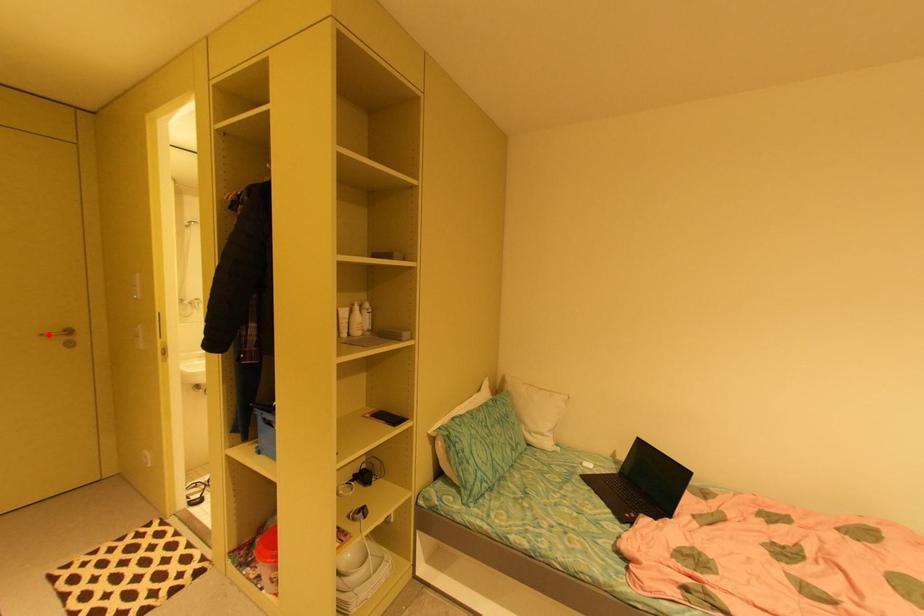
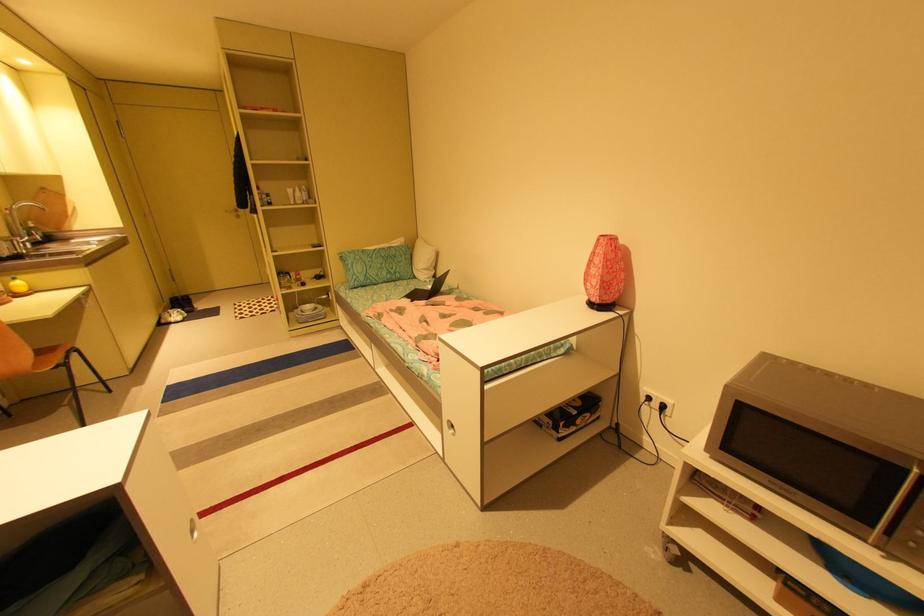
The point at the highlighted location is marked in the first image. Where is the corresponding point in the second image?

(232, 211)